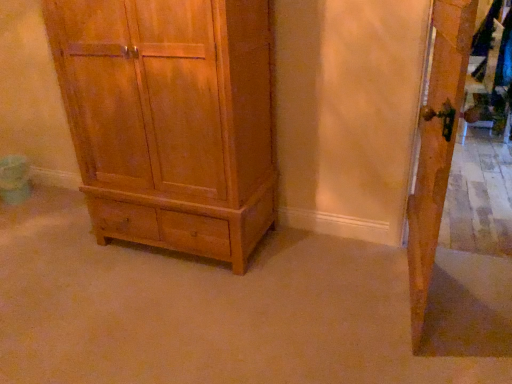
Find the location of `wooden door at right`. wooden door at right is located at coordinates (436, 147).

Describe the element at coordinates (436, 147) in the screenshot. The height and width of the screenshot is (384, 512). I see `wooden door at right` at that location.

Image resolution: width=512 pixels, height=384 pixels. In order to click on matte wood chest of drawers at center in this screenshot , I will do `click(170, 119)`.

This screenshot has height=384, width=512. What do you see at coordinates (170, 119) in the screenshot? I see `matte wood chest of drawers at center` at bounding box center [170, 119].

Image resolution: width=512 pixels, height=384 pixels. What are the coordinates of `wooden door at right` in the screenshot? It's located at (436, 147).

Which object is positioned more to the left, wooden door at right or matte wood chest of drawers at center?

matte wood chest of drawers at center is more to the left.

Is wooden door at right further to camera compared to matte wood chest of drawers at center?

No, wooden door at right is closer to the camera.

Considering the positions of points (455, 44) and (126, 111), is point (455, 44) closer to camera compared to point (126, 111)?

Yes.

From the image's perspective, is wooden door at right above or below matte wood chest of drawers at center?

From the image's perspective, wooden door at right appears below matte wood chest of drawers at center.

From a real-world perspective, is wooden door at right on top of matte wood chest of drawers at center?

No, from a real-world perspective, wooden door at right is not on top of matte wood chest of drawers at center.

Looking at their sizes, would you say wooden door at right is wider or thinner than matte wood chest of drawers at center?

Clearly, wooden door at right has less width compared to matte wood chest of drawers at center.

Can you confirm if wooden door at right is shorter than matte wood chest of drawers at center?

Yes.

Considering the sizes of objects wooden door at right and matte wood chest of drawers at center in the image provided, who is smaller, wooden door at right or matte wood chest of drawers at center?

With smaller size is wooden door at right.

Would you say wooden door at right is inside or outside matte wood chest of drawers at center?

wooden door at right lies outside matte wood chest of drawers at center.

Consider the image. Are wooden door at right and matte wood chest of drawers at center located far from each other?

wooden door at right is positioned a significant distance from matte wood chest of drawers at center.

Is wooden door at right facing away from matte wood chest of drawers at center?

wooden door at right does not have its back to matte wood chest of drawers at center.

From the picture: How different are the orientations of wooden door at right and matte wood chest of drawers at center in degrees?

wooden door at right and matte wood chest of drawers at center are facing 81.9 degrees away from each other.

There is a wooden door at right. At what (x,y) coordinates should I click in order to perform the action: click on the chest of drawers above it (from a real-world perspective). Please return your answer as a coordinate pair (x, y). Image resolution: width=512 pixels, height=384 pixels. Looking at the image, I should click on (170, 119).

Based on their positions, is matte wood chest of drawers at center located to the left or right of wooden door at right?

From the image, it's evident that matte wood chest of drawers at center is to the left of wooden door at right.

Considering the positions of objects matte wood chest of drawers at center and wooden door at right in the image provided, who is behind, matte wood chest of drawers at center or wooden door at right?

matte wood chest of drawers at center is more distant.

Considering the points (212, 179) and (472, 5), which point is behind, point (212, 179) or point (472, 5)?

The point (212, 179) is farther from the camera.

From the image's perspective, is matte wood chest of drawers at center above wooden door at right?

Correct, matte wood chest of drawers at center appears higher than wooden door at right in the image.

From a real-world perspective, does matte wood chest of drawers at center stand above wooden door at right?

Yes, from a real-world perspective, matte wood chest of drawers at center is on top of wooden door at right.

Which of these two, matte wood chest of drawers at center or wooden door at right, is wider?

matte wood chest of drawers at center is wider.

Considering the relative sizes of matte wood chest of drawers at center and wooden door at right in the image provided, is matte wood chest of drawers at center taller than wooden door at right?

Yes.

Considering the sizes of matte wood chest of drawers at center and wooden door at right in the image, is matte wood chest of drawers at center bigger or smaller than wooden door at right?

In the image, matte wood chest of drawers at center appears to be larger than wooden door at right.

Do you think matte wood chest of drawers at center is within wooden door at right, or outside of it?

matte wood chest of drawers at center is located beyond the bounds of wooden door at right.

Is matte wood chest of drawers at center far away from wooden door at right?

Yes.

Is wooden door at right at the back of matte wood chest of drawers at center?

matte wood chest of drawers at center is not turned away from wooden door at right.

Where is `door on the right of matte wood chest of drawers at center`? Image resolution: width=512 pixels, height=384 pixels. door on the right of matte wood chest of drawers at center is located at coordinates 436,147.

Locate an element on the screen. The height and width of the screenshot is (384, 512). the chest of drawers above the wooden door at right (from the image's perspective) is located at coordinates (170, 119).

Locate an element on the screen. Image resolution: width=512 pixels, height=384 pixels. chest of drawers that appears on the left of wooden door at right is located at coordinates (170, 119).